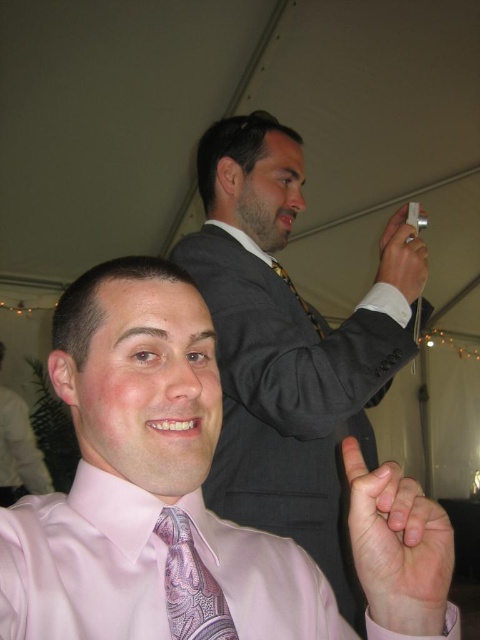
Question: Which point is farther to the camera?

Choices:
 (A) (262, 122)
 (B) (282, 268)
 (C) (48, 360)
 (D) (395, 266)

Answer: (A)

Question: Which object is the closest to the pink paisley tie at lower center?

Choices:
 (A) patterned silk tie at upper center
 (B) pink satin shirt at lower center
 (C) matte gray suit at upper center
 (D) pink satin tie at lower center

Answer: (B)

Question: Is matte gray suit at upper center closer to camera compared to white plastic remote at upper right?

Choices:
 (A) yes
 (B) no

Answer: (A)

Question: Is pink satin shirt at lower center to the right of patterned silk tie at upper center from the viewer's perspective?

Choices:
 (A) yes
 (B) no

Answer: (B)

Question: Which point is farther from the camera taking this photo?

Choices:
 (A) (292, 548)
 (B) (265, 548)

Answer: (A)

Question: Is pink paisley tie at lower center positioned in front of patterned silk tie at upper center?

Choices:
 (A) no
 (B) yes

Answer: (B)